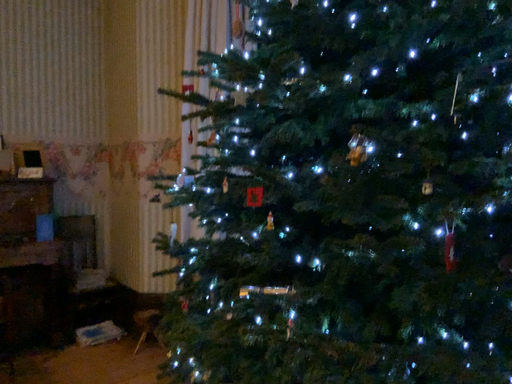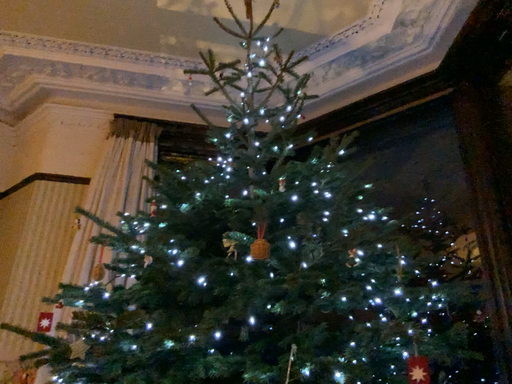
Question: Which way did the camera rotate in the video?

Choices:
 (A) rotated left
 (B) rotated right

Answer: (B)